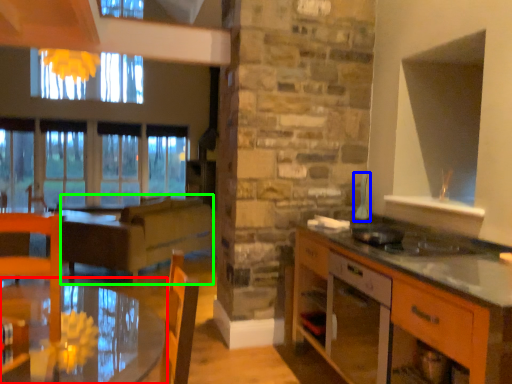
Question: Which object is the farthest from table (highlighted by a red box)? Choose among these: appliance (highlighted by a blue box) or surround (highlighted by a green box).

Choices:
 (A) appliance
 (B) surround

Answer: (A)